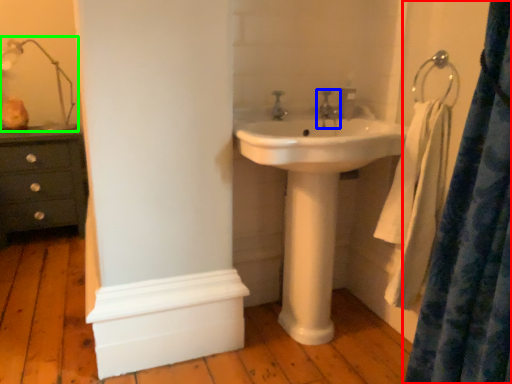
Question: Which object is the farthest from curtain (highlighted by a red box)? Choose among these: tap (highlighted by a blue box) or table lamp (highlighted by a green box).

Choices:
 (A) tap
 (B) table lamp

Answer: (B)